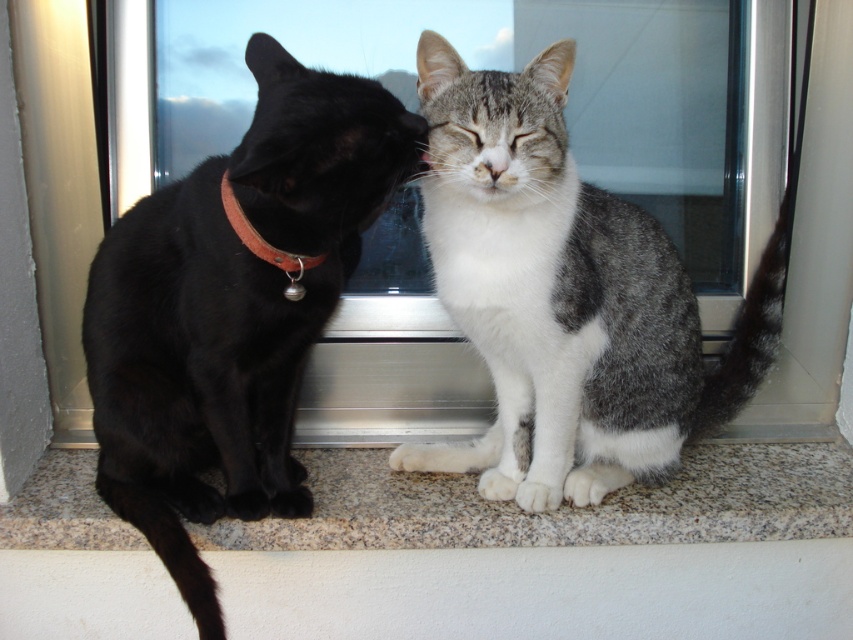
You are a photographer trying to capture a closeup of the granite at lower center. Your camera has a minimum focusing distance of 1.2 meters. Can you take the photo without moving the camera?

The granite at lower center is 1.34 meters away from the camera, which is beyond the minimum focusing distance of 1.2 meters. Therefore, the photographer can take the photo without moving the camera since the distance is sufficient.